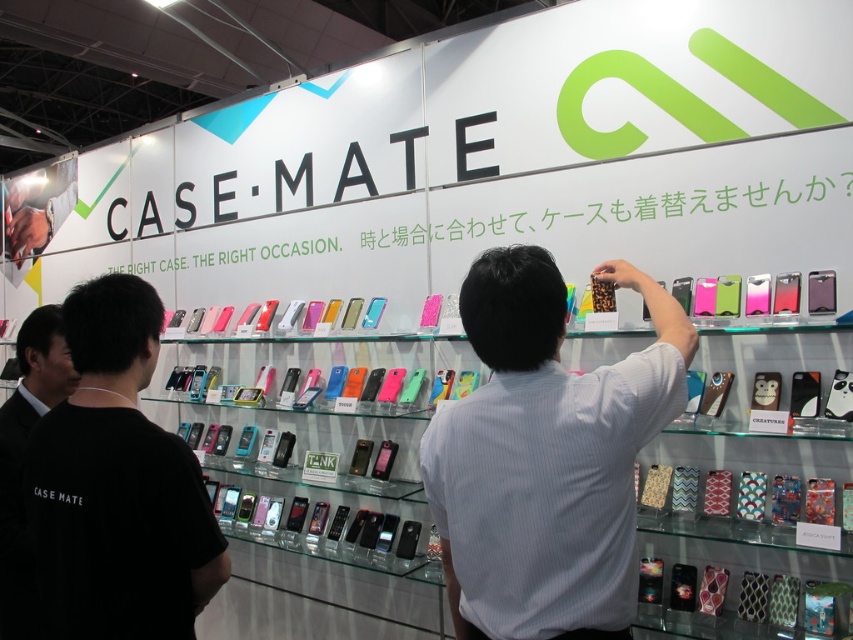
You are at a trade show and want to compare two items displayed on the same shelf. You see a leopard print case at upper center and a black shirt at left. Which item is positioned to the right of the other?

The leopard print case at upper center is to the right of the black shirt at left.